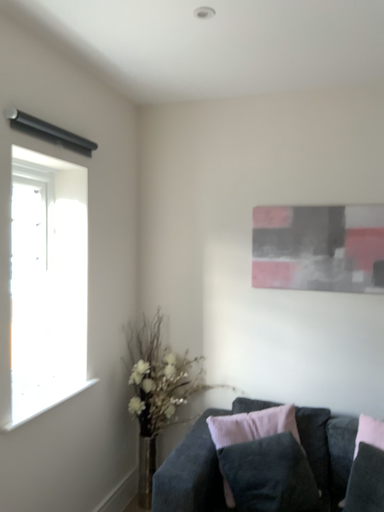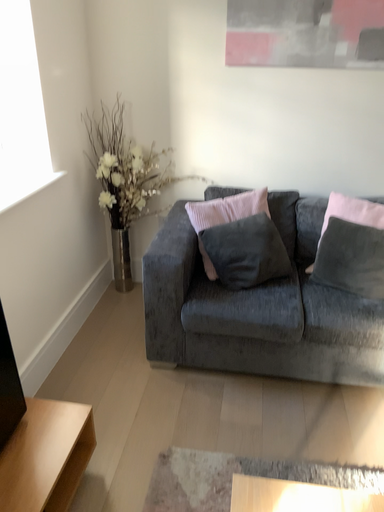
Question: Which way did the camera rotate in the video?

Choices:
 (A) rotated right
 (B) rotated left

Answer: (A)